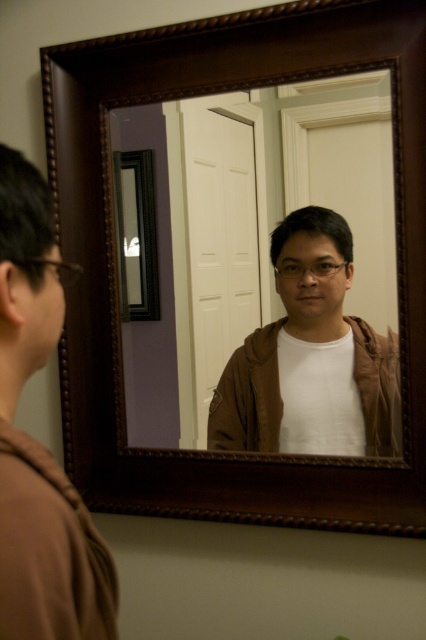
You are a painter trying to set up an easel in this room. You notice two points marked on the wall at coordinates point (238, 387) and point (365, 419). Which point is closer to you so you can place your easel there?

Point (238, 387) is further to the viewer than point (365, 419), so the closer point to you is point (365, 419). Place your easel there.

You are standing in the room and want to place a small decorative item on the brown matte jacket at lower left. Based on its position, where should you place the item to ensure it stays centered on the jacket?

The brown matte jacket at lower left is located at point coordinates (39, 442), so placing the item at those coordinates would center it on the jacket.